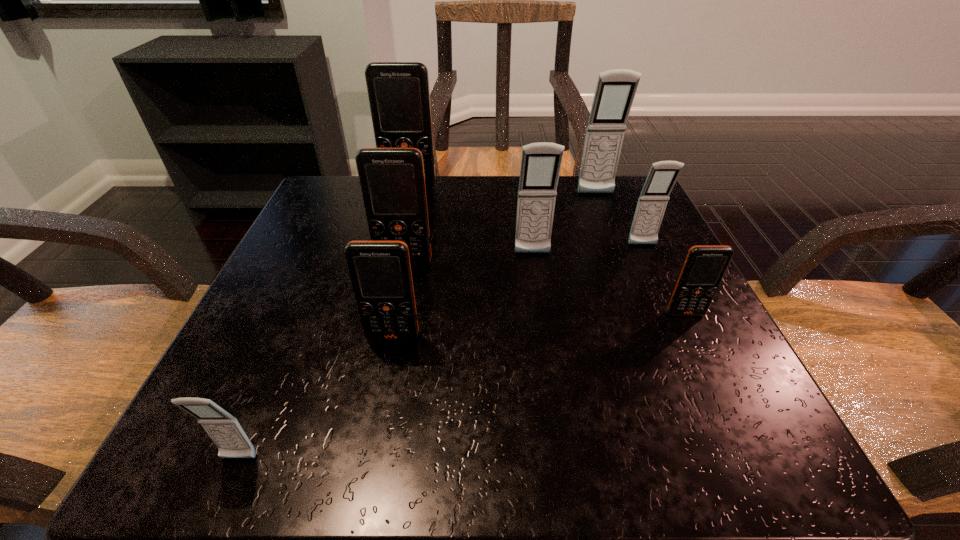
Find the location of a particular element. This screenshot has height=540, width=960. the third nearest cellular telephone is located at coordinates (704, 267).

Locate an element on the screen. the sixth farthest object is located at coordinates (704, 267).

Find the location of a particular element. Image resolution: width=960 pixels, height=540 pixels. the nearest object is located at coordinates (223, 428).

Find the location of a particular element. This screenshot has height=540, width=960. the leftmost cellular telephone is located at coordinates (223, 428).

The image size is (960, 540). I want to click on vacant space located 0.080m on the screen of the farthest orange cellular telephone, so click(x=405, y=210).

The image size is (960, 540). Find the location of `free location located on the front-facing side of the farthest gray cellular telephone`. free location located on the front-facing side of the farthest gray cellular telephone is located at coordinates (642, 315).

This screenshot has width=960, height=540. In order to click on free region located 0.390m on the front-facing side of the fifth object from left to right in this screenshot , I will do `click(563, 464)`.

The image size is (960, 540). Find the location of `vacant area situated 0.240m on the screen of the fourth nearest cellular telephone`. vacant area situated 0.240m on the screen of the fourth nearest cellular telephone is located at coordinates (381, 380).

Locate an element on the screen. Image resolution: width=960 pixels, height=540 pixels. vacant space situated on the front-facing side of the third farthest cellular telephone is located at coordinates (667, 300).

Locate an element on the screen. Image resolution: width=960 pixels, height=540 pixels. vacant space located 0.070m on the screen of the nearest orange cellular telephone is located at coordinates tap(385, 382).